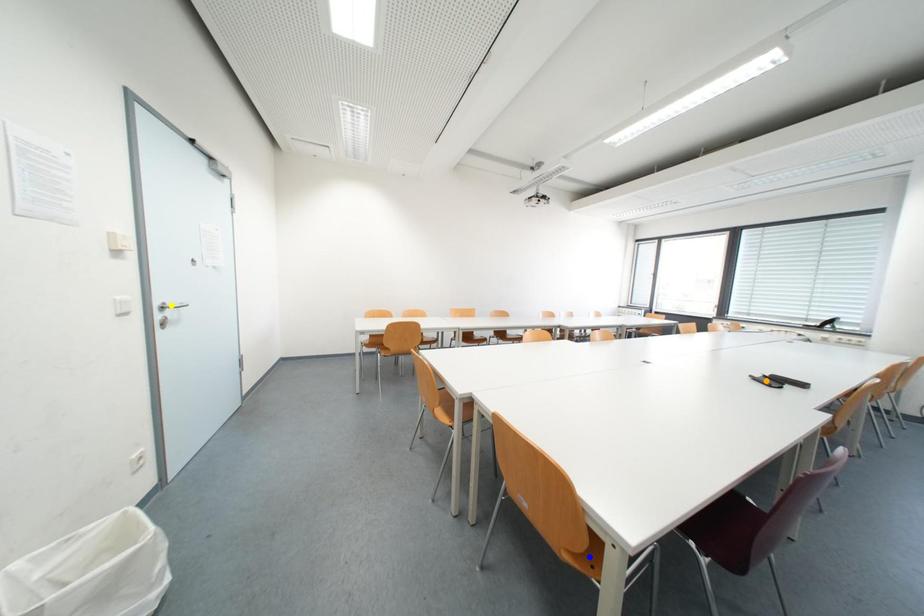
Order these from nearest to farthest:
orange point
blue point
yellow point

blue point < yellow point < orange point